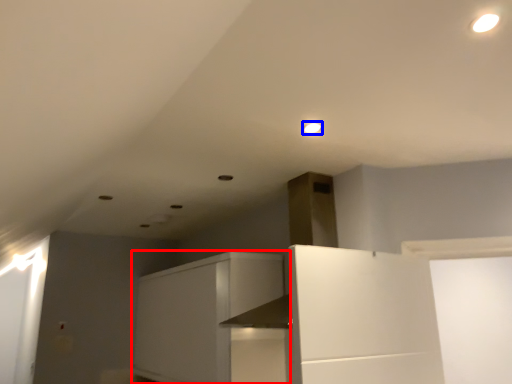
Question: Which object is further to the camera taking this photo, cabinetry (highlighted by a red box) or lighting (highlighted by a blue box)?

Choices:
 (A) cabinetry
 (B) lighting

Answer: (A)